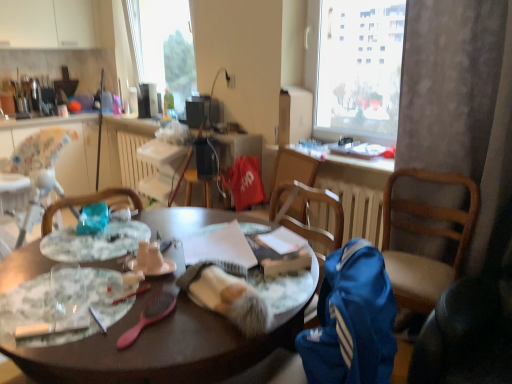
Question: From a real-world perspective, does translucent plastic bottle at upper center sit lower than matte white coffee cup at center?

Choices:
 (A) yes
 (B) no

Answer: (B)

Question: Considering the relative sizes of translucent plastic bottle at upper center and matte white coffee cup at center in the image provided, is translucent plastic bottle at upper center thinner than matte white coffee cup at center?

Choices:
 (A) no
 (B) yes

Answer: (A)

Question: Can you confirm if translucent plastic bottle at upper center is positioned to the right of matte white coffee cup at center?

Choices:
 (A) yes
 (B) no

Answer: (B)

Question: Can you confirm if translucent plastic bottle at upper center is smaller than matte white coffee cup at center?

Choices:
 (A) no
 (B) yes

Answer: (A)

Question: Does translucent plastic bottle at upper center have a larger size compared to matte white coffee cup at center?

Choices:
 (A) no
 (B) yes

Answer: (B)

Question: Considering the relative sizes of translucent plastic bottle at upper center and matte white coffee cup at center in the image provided, is translucent plastic bottle at upper center taller than matte white coffee cup at center?

Choices:
 (A) yes
 (B) no

Answer: (A)

Question: Is matte black lamp at upper center positioned with its back to white textured curtain at right?

Choices:
 (A) yes
 (B) no

Answer: (B)

Question: Could white textured curtain at right be considered to be inside matte black lamp at upper center?

Choices:
 (A) no
 (B) yes

Answer: (A)

Question: Is matte black lamp at upper center aimed at white textured curtain at right?

Choices:
 (A) yes
 (B) no

Answer: (B)

Question: Does matte black lamp at upper center appear on the left side of white textured curtain at right?

Choices:
 (A) yes
 (B) no

Answer: (A)

Question: From the image's perspective, is matte black lamp at upper center above white textured curtain at right?

Choices:
 (A) no
 (B) yes

Answer: (B)

Question: Does matte black lamp at upper center have a greater width compared to white textured curtain at right?

Choices:
 (A) yes
 (B) no

Answer: (B)

Question: Does white glossy countertop at upper left lie behind wooden table at center?

Choices:
 (A) yes
 (B) no

Answer: (A)